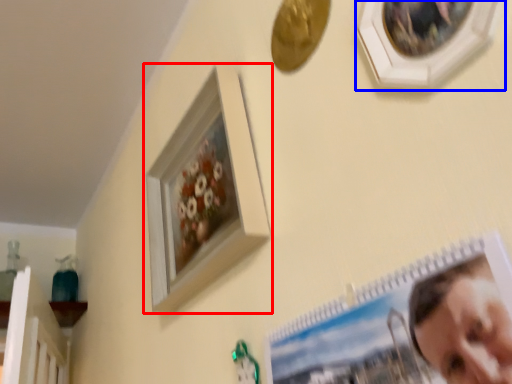
Question: Which of the following is the closest to the observer, picture frame (highlighted by a red box) or picture frame (highlighted by a blue box)?

Choices:
 (A) picture frame
 (B) picture frame

Answer: (B)